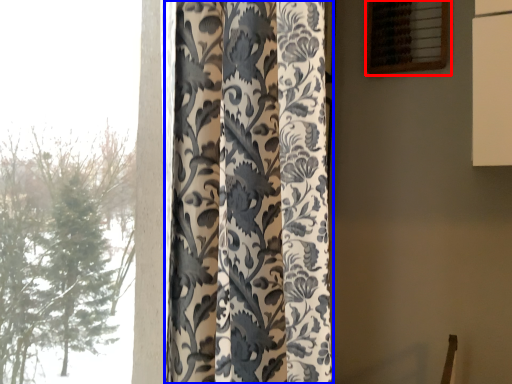
Question: Which object is closer to the camera taking this photo, window (highlighted by a red box) or curtain (highlighted by a blue box)?

Choices:
 (A) window
 (B) curtain

Answer: (B)